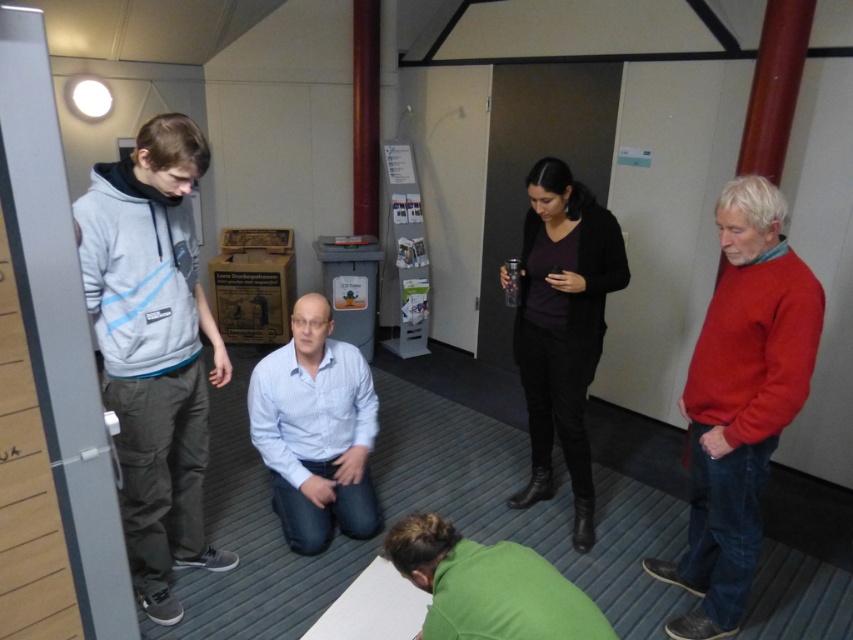
Question: Among these points, which one is farthest from the camera?

Choices:
 (A) (701, 504)
 (B) (471, 634)

Answer: (A)

Question: From the image, what is the correct spatial relationship of red sweater at right in relation to green matte shirt at lower center?

Choices:
 (A) left
 (B) right

Answer: (B)

Question: Does red sweater at right have a greater width compared to green matte shirt at lower center?

Choices:
 (A) no
 (B) yes

Answer: (A)

Question: Estimate the real-world distances between objects in this image. Which object is farther from the green matte shirt at lower center?

Choices:
 (A) light gray hoodie at left
 (B) matte black sweater at center
 (C) red sweater at right
 (D) light blue shirt at center

Answer: (B)

Question: Considering the relative positions of red sweater at right and matte black sweater at center in the image provided, where is red sweater at right located with respect to matte black sweater at center?

Choices:
 (A) above
 (B) below

Answer: (B)

Question: Which of these objects is positioned farthest from the matte black sweater at center?

Choices:
 (A) light gray hoodie at left
 (B) green matte shirt at lower center
 (C) light blue shirt at center
 (D) red sweater at right

Answer: (A)